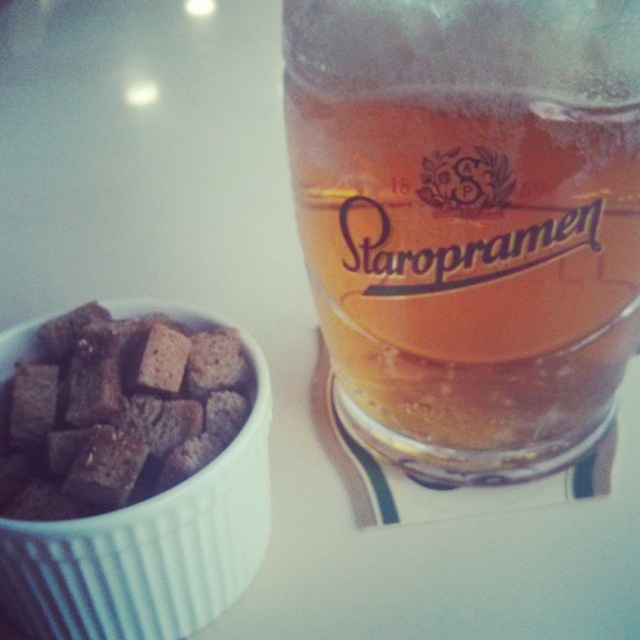
Question: Which point appears farthest from the camera in this image?

Choices:
 (A) (461, 113)
 (B) (93, 490)

Answer: (B)

Question: Is translucent glass beer at upper right bigger than brown crumbly bread at left?

Choices:
 (A) yes
 (B) no

Answer: (A)

Question: Does translucent glass beer at upper right appear under brown crumbly bread at left?

Choices:
 (A) yes
 (B) no

Answer: (B)

Question: Can you confirm if translucent glass beer at upper right is bigger than brown crumbly bread at left?

Choices:
 (A) yes
 (B) no

Answer: (A)